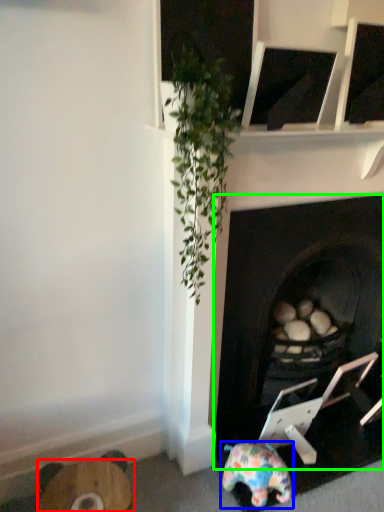
Question: Which is nearer to the furniture (highlighted by a red box)? toy (highlighted by a blue box) or fireplace (highlighted by a green box).

Choices:
 (A) toy
 (B) fireplace

Answer: (A)